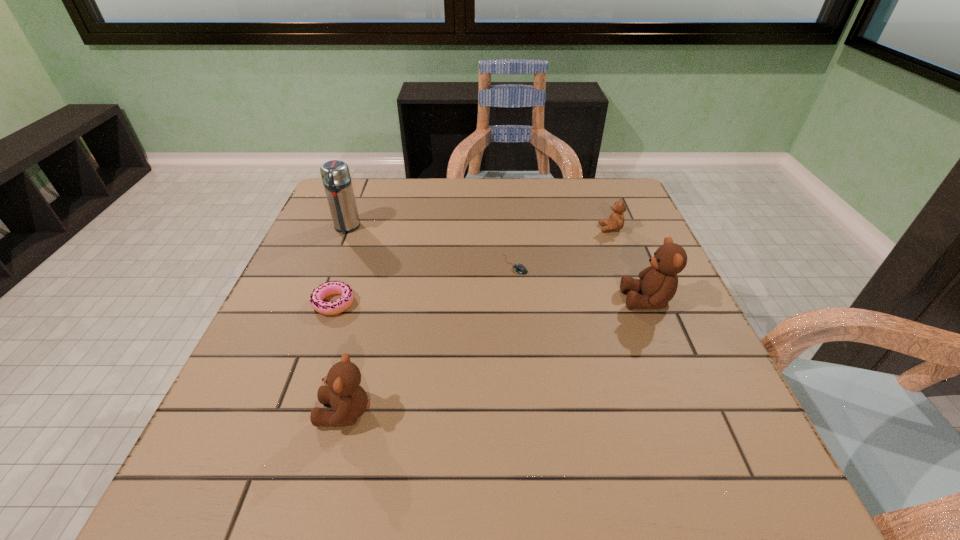
The width and height of the screenshot is (960, 540). In order to click on the nearest object in this screenshot , I will do `click(349, 401)`.

What are the coordinates of `the second tallest teddy bear` in the screenshot? It's located at (349, 401).

Find the location of a particular element. The width and height of the screenshot is (960, 540). the second farthest teddy bear is located at coordinates (659, 282).

Find the location of `the tallest teddy bear`. the tallest teddy bear is located at coordinates (659, 282).

Locate an element on the screen. This screenshot has width=960, height=540. mouse is located at coordinates (519, 268).

I want to click on the fourth object from left to right, so click(x=519, y=268).

This screenshot has height=540, width=960. What are the coordinates of `the fourth tallest object` in the screenshot? It's located at (616, 220).

The image size is (960, 540). What are the coordinates of `the shortest teddy bear` in the screenshot? It's located at (616, 220).

You are a GUI agent. You are given a task and a screenshot of the screen. Output one action in this format:
    pyautogui.click(x=<x>, y=<y>)
    Task: Click on the doughnut
    The width and height of the screenshot is (960, 540).
    Given the screenshot: What is the action you would take?
    pyautogui.click(x=328, y=288)

Locate an element on the screen. The image size is (960, 540). the tallest object is located at coordinates (335, 174).